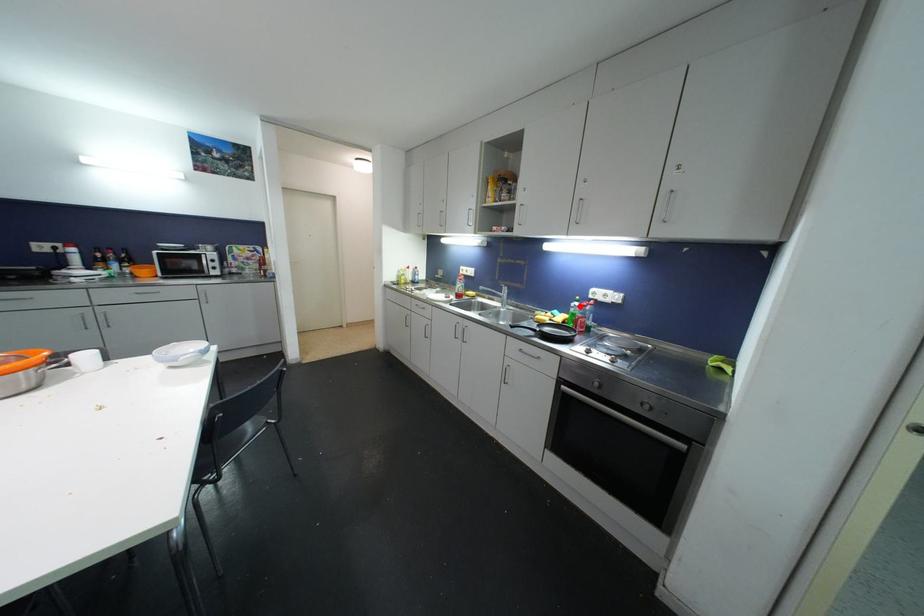
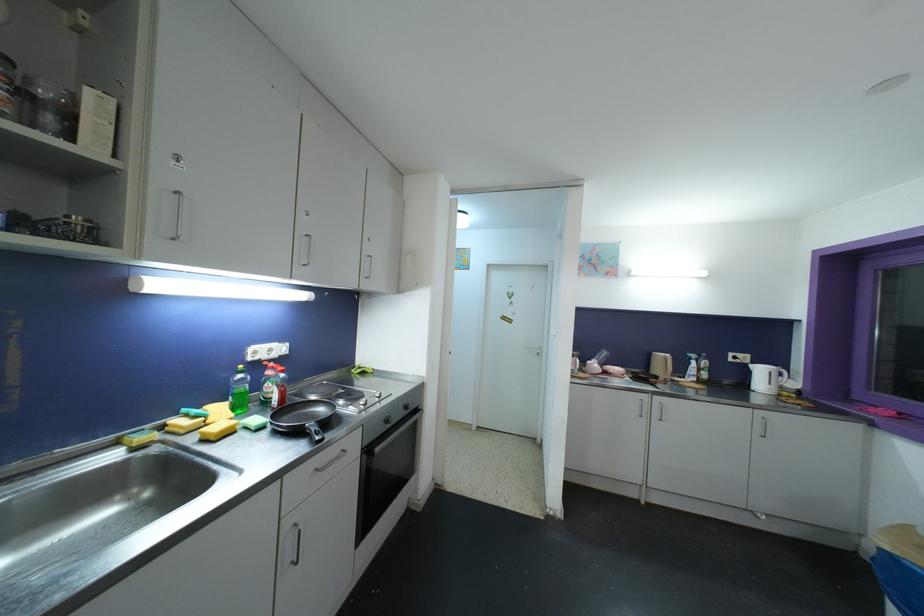
In the second image, find the point that corresponds to the highlighted location in the first image.

(244, 379)